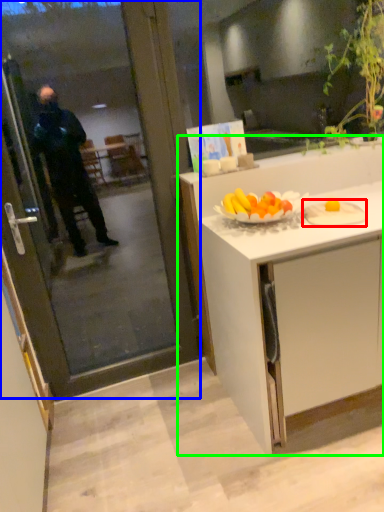
Question: Estimate the real-world distances between objects in this image. Which object is farther from plate (highlighted by a red box), screen door (highlighted by a blue box) or cabinetry (highlighted by a green box)?

Choices:
 (A) screen door
 (B) cabinetry

Answer: (A)